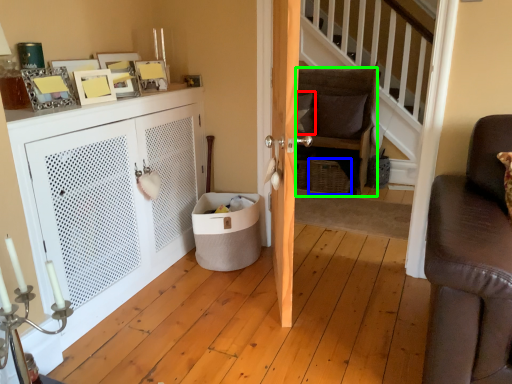
Question: Which object is the closest to the pillow (highlighted by a red box)? Choose among these: basket (highlighted by a blue box) or chair (highlighted by a green box).

Choices:
 (A) basket
 (B) chair

Answer: (B)